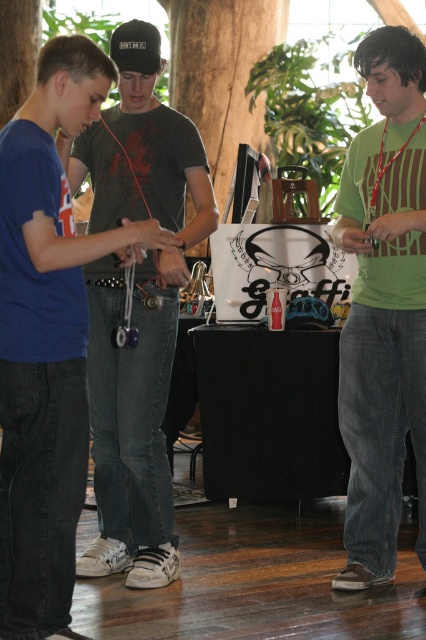
Can you confirm if green matte shirt at right is positioned to the left of black matte baseball cap at upper left?

Incorrect, green matte shirt at right is not on the left side of black matte baseball cap at upper left.

Does green matte shirt at right have a larger size compared to black matte baseball cap at upper left?

Indeed, green matte shirt at right has a larger size compared to black matte baseball cap at upper left.

Is point (371, 493) positioned in front of point (123, 35)?

No, (371, 493) is behind (123, 35).

Identify the location of green matte shirt at right. The width and height of the screenshot is (426, 640). (383, 307).

Identify the location of dark green t-shirt at center. The image size is (426, 640). (132, 420).

Does point (138, 81) come closer to viewer compared to point (354, 200)?

That is True.

Image resolution: width=426 pixels, height=640 pixels. What are the coordinates of `dark green t-shirt at center` in the screenshot? It's located at (132, 420).

Is dark green t-shirt at center wider than black matte baseball cap at upper left?

Yes.

Is point (81, 141) positioned before point (138, 28)?

No, it is not.

Locate an element on the screen. dark green t-shirt at center is located at coordinates (132, 420).